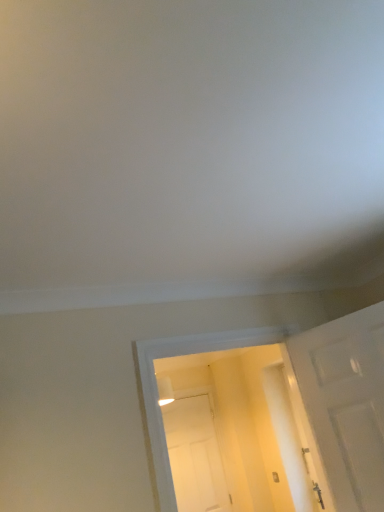
The image size is (384, 512). What do you see at coordinates (195, 455) in the screenshot?
I see `white matte door at center, which appears as the second door when viewed from the right` at bounding box center [195, 455].

Locate an element on the screen. white matte door at center, which is the first door from back to front is located at coordinates (195, 455).

In order to face white matte door at center, marked as the first door in a left-to-right arrangement, should I rotate leftwards or rightwards?

You should look right and rotate roughly 0.353 degrees.

This screenshot has width=384, height=512. What do you see at coordinates (343, 406) in the screenshot? I see `white matte door at right, arranged as the second door when ordered from the bottom` at bounding box center [343, 406].

In order to click on white matte door at right, acting as the 1th door starting from the front in this screenshot , I will do `click(343, 406)`.

Measure the distance between point (378, 490) and camera.

Point (378, 490) is 1.97 meters away from camera.

This screenshot has width=384, height=512. Find the location of `white matte door at center, the first door ordered from the bottom`. white matte door at center, the first door ordered from the bottom is located at coordinates (195, 455).

Can you confirm if white matte door at center, which appears as the second door when viewed from the top, is positioned to the right of white matte door at right, arranged as the 2th door when viewed from the left?

Incorrect, white matte door at center, which appears as the second door when viewed from the top, is not on the right side of white matte door at right, arranged as the 2th door when viewed from the left.

Relative to white matte door at right, the second door positioned from the back, is white matte door at center, which is the first door from back to front, in front or behind?

Clearly, white matte door at center, which is the first door from back to front, is behind white matte door at right, the second door positioned from the back.

Considering the positions of points (198, 485) and (312, 414), is point (198, 485) closer to camera compared to point (312, 414)?

No, it is behind (312, 414).

From the image's perspective, which is above, white matte door at center, the second door when ordered from front to back, or white matte door at right, arranged as the 2th door when viewed from the left?

white matte door at right, arranged as the 2th door when viewed from the left, is shown above in the image.

From a real-world perspective, between white matte door at center, which appears as the second door when viewed from the top, and white matte door at right, arranged as the second door when ordered from the bottom, who is vertically lower?

white matte door at center, which appears as the second door when viewed from the top, from a real-world perspective.

Does white matte door at center, the second door when ordered from front to back, have a lesser width compared to white matte door at right, arranged as the second door when ordered from the bottom?

No, white matte door at center, the second door when ordered from front to back, is not thinner than white matte door at right, arranged as the second door when ordered from the bottom.

Considering the sizes of white matte door at center, the second door when ordered from front to back, and white matte door at right, acting as the 1th door starting from the front, in the image, is white matte door at center, the second door when ordered from front to back, taller or shorter than white matte door at right, acting as the 1th door starting from the front,?

In the image, white matte door at center, the second door when ordered from front to back, appears to be taller than white matte door at right, acting as the 1th door starting from the front.

Is white matte door at center, which appears as the second door when viewed from the right, bigger or smaller than white matte door at right, arranged as the second door when ordered from the bottom?

Considering their sizes, white matte door at center, which appears as the second door when viewed from the right, takes up more space than white matte door at right, arranged as the second door when ordered from the bottom.

Can white matte door at right, arranged as the 2th door when viewed from the left, be found inside white matte door at center, which is the first door from back to front?

No, white matte door at right, arranged as the 2th door when viewed from the left, is located outside of white matte door at center, which is the first door from back to front.

Looking at this image, is white matte door at center, the first door ordered from the bottom, far away from white matte door at right, which ranks as the first door in top-to-bottom order?

white matte door at center, the first door ordered from the bottom, is far away from white matte door at right, which ranks as the first door in top-to-bottom order.

Is white matte door at center, which appears as the second door when viewed from the right, looking in the opposite direction of white matte door at right, the second door positioned from the back?

No, white matte door at center, which appears as the second door when viewed from the right,'s orientation is not away from white matte door at right, the second door positioned from the back.

How many degrees apart are the facing directions of white matte door at center, marked as the first door in a left-to-right arrangement, and white matte door at right, which ranks as the first door in top-to-bottom order?

67.5 degrees separate the facing orientations of white matte door at center, marked as the first door in a left-to-right arrangement, and white matte door at right, which ranks as the first door in top-to-bottom order.

Could you measure the distance between white matte door at center, which appears as the second door when viewed from the right, and white matte door at right, the second door positioned from the back?

white matte door at center, which appears as the second door when viewed from the right, and white matte door at right, the second door positioned from the back, are 2.16 meters apart.

The width and height of the screenshot is (384, 512). I want to click on door lying on the right of white matte door at center, the first door ordered from the bottom, so click(343, 406).

Is white matte door at right, arranged as the second door when ordered from the bottom, at the right side of white matte door at center, which is the first door from back to front?

Yes, white matte door at right, arranged as the second door when ordered from the bottom, is to the right of white matte door at center, which is the first door from back to front.

Is white matte door at right, arranged as the second door when ordered from the bottom, closer to camera compared to white matte door at center, the second door when ordered from front to back?

Yes, it is.

Is point (375, 379) in front of point (178, 499)?

Yes.

From the image's perspective, is white matte door at right, the second door positioned from the back, on white matte door at center, which appears as the second door when viewed from the top?

Indeed, from the image's perspective, white matte door at right, the second door positioned from the back, is shown above white matte door at center, which appears as the second door when viewed from the top.

From a real-world perspective, between white matte door at right, which ranks as the first door in top-to-bottom order, and white matte door at center, which appears as the second door when viewed from the top, who is vertically higher?

white matte door at right, which ranks as the first door in top-to-bottom order, is physically above.

Which of these two, white matte door at right, which appears as the first door when viewed from the right, or white matte door at center, marked as the first door in a left-to-right arrangement, is wider?

Wider between the two is white matte door at center, marked as the first door in a left-to-right arrangement.

Is white matte door at right, acting as the 1th door starting from the front, shorter than white matte door at center, the second door when ordered from front to back?

Yes, white matte door at right, acting as the 1th door starting from the front, is shorter than white matte door at center, the second door when ordered from front to back.

Between white matte door at right, which ranks as the first door in top-to-bottom order, and white matte door at center, which appears as the second door when viewed from the right, which one has smaller size?

Smaller between the two is white matte door at right, which ranks as the first door in top-to-bottom order.

Consider the image. Which is correct: white matte door at right, acting as the 1th door starting from the front, is inside white matte door at center, which is the first door from back to front, or outside of it?

white matte door at right, acting as the 1th door starting from the front, lies outside white matte door at center, which is the first door from back to front.

Is white matte door at right, acting as the 1th door starting from the front, beside white matte door at center, which appears as the second door when viewed from the top?

white matte door at right, acting as the 1th door starting from the front, and white matte door at center, which appears as the second door when viewed from the top, are clearly separated.

Is white matte door at right, which appears as the first door when viewed from the right, facing away from white matte door at center, the first door ordered from the bottom?

No.

You are a GUI agent. You are given a task and a screenshot of the screen. Output one action in this format:
    pyautogui.click(x=<x>, y=<y>)
    Task: Click on the door behind the white matte door at right, the second door positioned from the back
    
    Given the screenshot: What is the action you would take?
    pyautogui.click(x=195, y=455)

At what (x,y) coordinates should I click in order to perform the action: click on door behind the white matte door at right, acting as the 1th door starting from the front. Please return your answer as a coordinate pair (x, y). The width and height of the screenshot is (384, 512). Looking at the image, I should click on (195, 455).

This screenshot has width=384, height=512. In the image, there is a white matte door at center, which appears as the second door when viewed from the right. Find the location of `door above it (from the image's perspective)`. door above it (from the image's perspective) is located at coordinates (x=343, y=406).